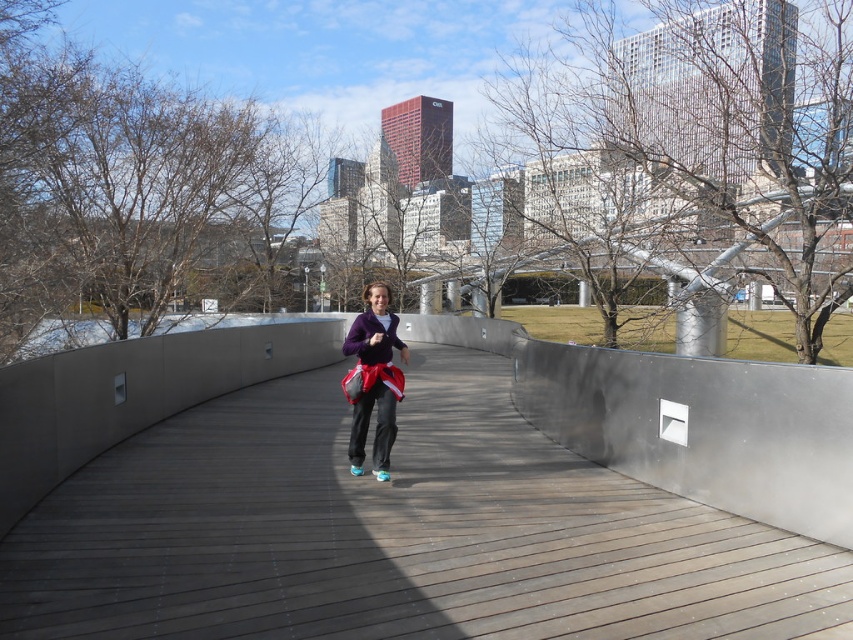
Question: Considering the relative positions of wooden at center and purple fleece sweatshirt at center in the image provided, where is wooden at center located with respect to purple fleece sweatshirt at center?

Choices:
 (A) left
 (B) right

Answer: (A)

Question: Does wooden at center come behind purple fleece sweatshirt at center?

Choices:
 (A) yes
 (B) no

Answer: (B)

Question: Estimate the real-world distances between objects in this image. Which object is closer to the purple fleece sweatshirt at center?

Choices:
 (A) wooden at center
 (B) matte purple jacket at center

Answer: (B)

Question: Which object is closer to the camera taking this photo?

Choices:
 (A) wooden at center
 (B) matte purple jacket at center

Answer: (A)

Question: Which object is the farthest from the purple fleece sweatshirt at center?

Choices:
 (A) matte purple jacket at center
 (B) wooden at center

Answer: (B)

Question: Does wooden at center come behind matte purple jacket at center?

Choices:
 (A) no
 (B) yes

Answer: (A)